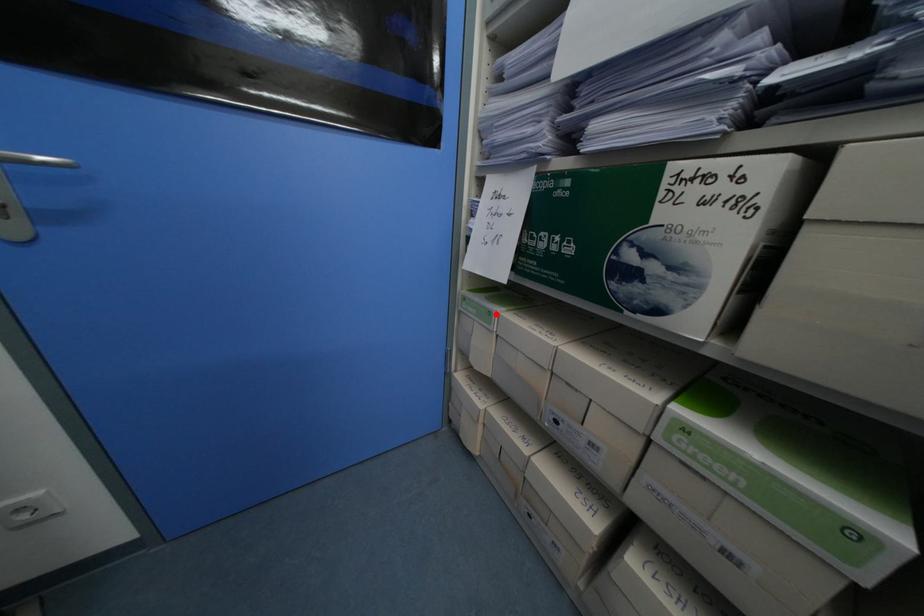
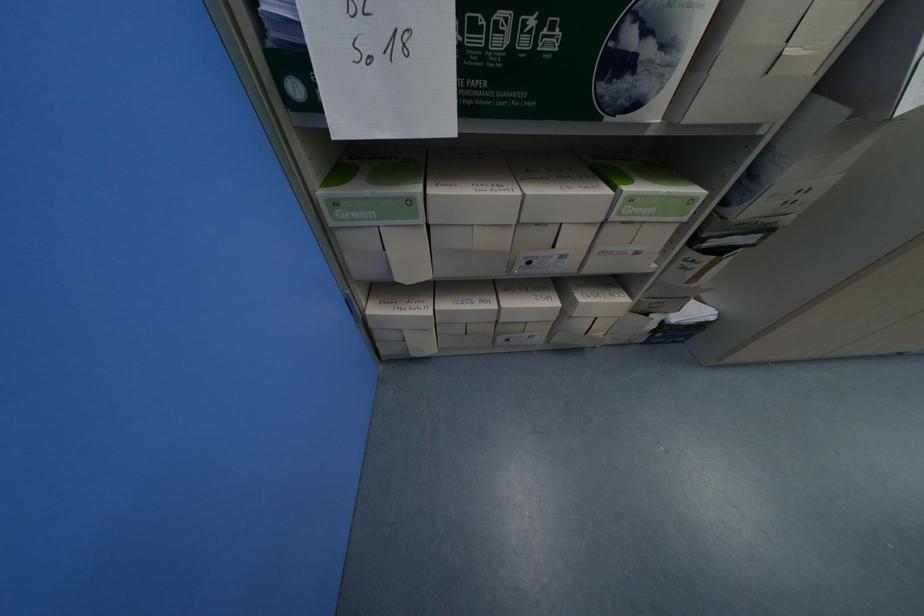
Locate, in the second image, the point that corresponds to the highlighted location in the first image.

(417, 203)